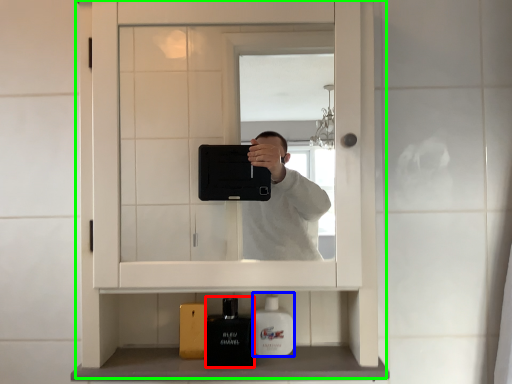
Question: Which object is the farthest from toiletry (highlighted by a red box)? Choose among these: mouthwash (highlighted by a blue box) or medicine cabinet (highlighted by a green box).

Choices:
 (A) mouthwash
 (B) medicine cabinet

Answer: (B)